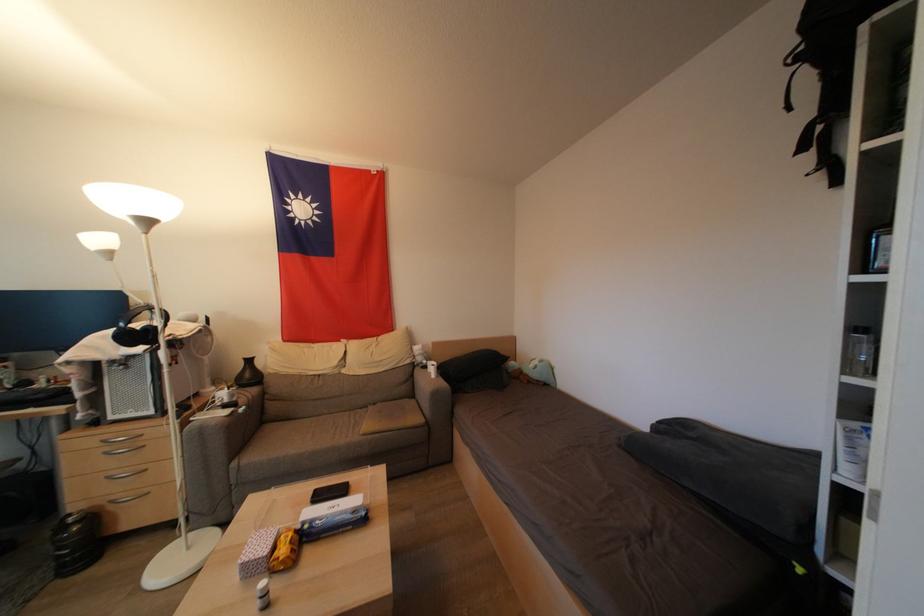
The height and width of the screenshot is (616, 924). I want to click on white cosmetic tube, so click(262, 594).